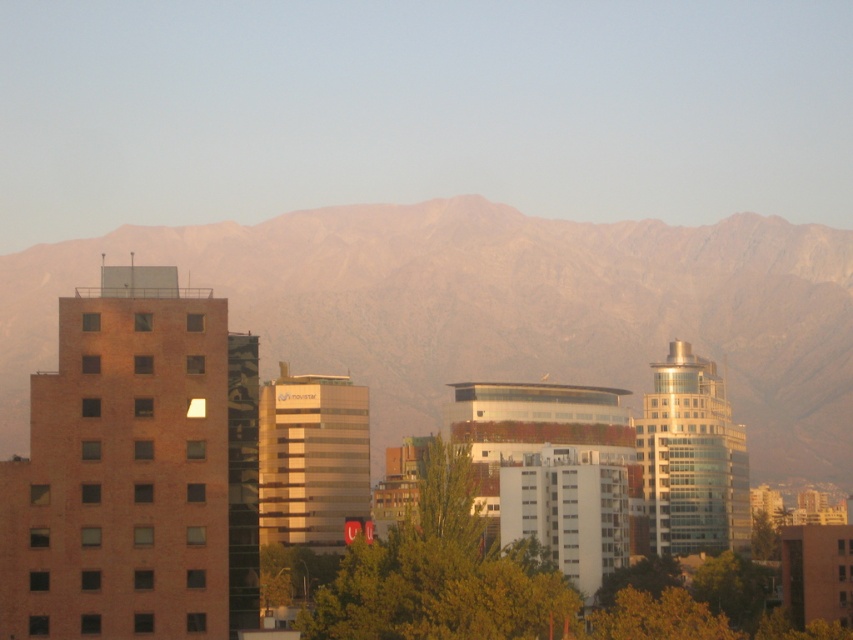
You are a drone operator planning to fly a drone from the green leafy tree at center to the rocky brown mountain range at upper center. Given that your drone has a maximum flight range of 300 feet, will it be able to reach the destination without recharging?

The rocky brown mountain range at upper center is 355.34 feet from the green leafy tree at center. Since the distance exceeds the drone operator drone has a maximum flight range of 300 feet, the drone will not be able to reach the destination without recharging.

What is the exact location of the rocky brown mountain range at upper center in the image?

The rocky brown mountain range at upper center is located at point (496, 310).

You are a photographer planning to capture the entire scene in one shot. Considering the rocky brown mountain range at upper center and the green leafy tree at center, which object will occupy more space in your photo?

The rocky brown mountain range at upper center will occupy more space in the photo because it has a larger size compared to the green leafy tree at center.